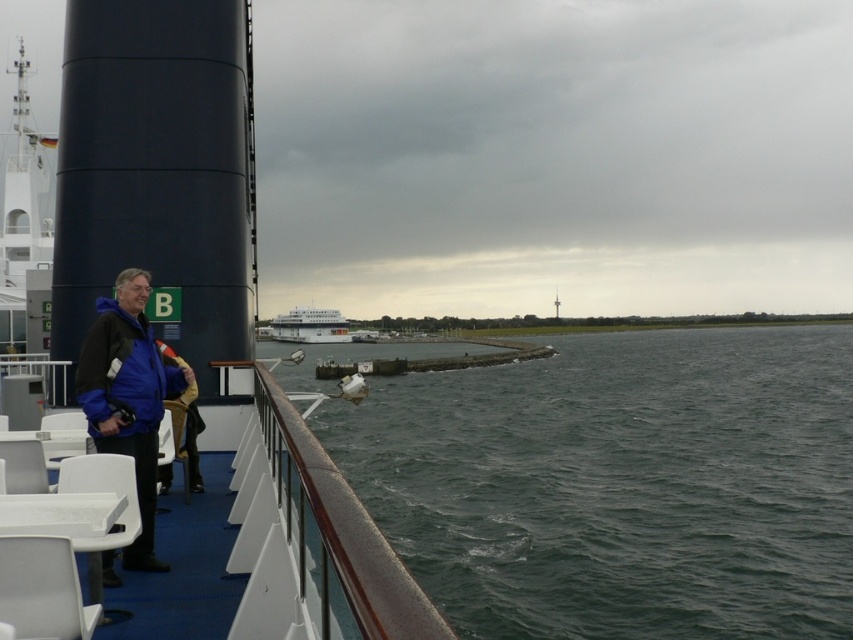
You are standing on the deck of the ferry and want to take a photo of the white glossy cruise ship at center. There is a person wearing a blue fabric jacket at left blocking your view. To avoid the person, should you move to your left or right?

The blue fabric jacket at left is to the right of the white glossy cruise ship at center. To avoid the person blocking the view, you should move to your left so that the blue fabric jacket at left is no longer between you and the white glossy cruise ship at center.

You are on the deck of a ship and see a matte black boat at left and a blue fabric jacket at lower left. Which object is closer to you?

The matte black boat at left is closer to you because it is in front of the blue fabric jacket at lower left.